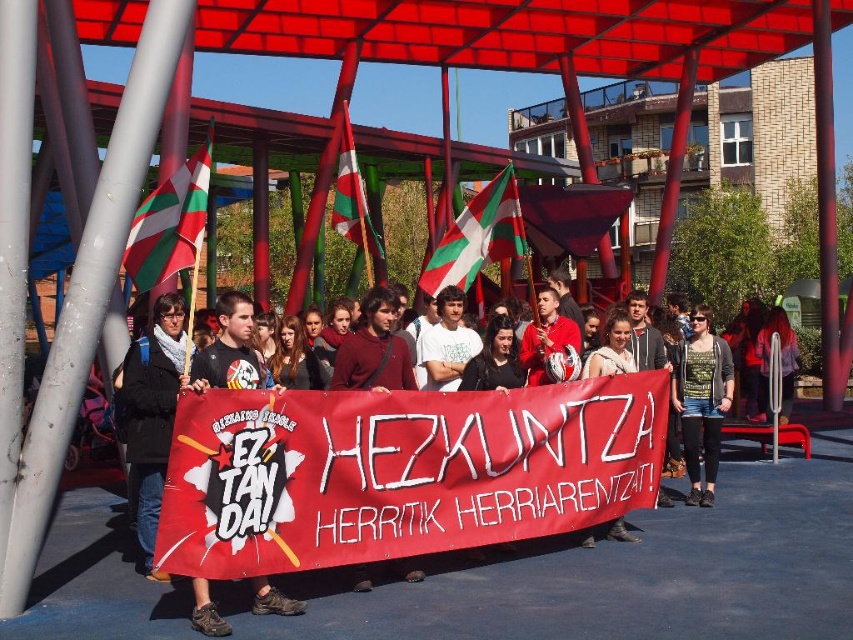
You are a photographer at the event and want to capture both the black fabric banner at center and the white and green striped flag at center in a single frame. Which object should you focus on to ensure both are visible without needing to adjust your camera angle?

The black fabric banner at center is much taller than the white and green striped flag at center. To include both in the frame, focus on the taller banner to accommodate its height while ensuring the flag remains in view.

You are standing at the position of the banner HE. Can you see the point at coordinates point (508, 257) behind the point at coordinates point (207, 632)?

Yes, since point (207, 632) is in front of point (508, 257), the latter would be obscured from your view by the former.